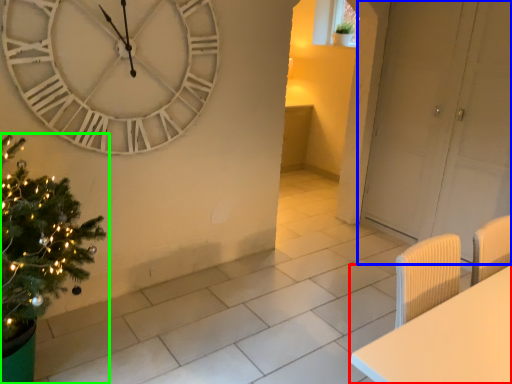
Question: Estimate the real-world distances between objects in this image. Which object is closer to furniture (highlighted by a red box), door (highlighted by a blue box) or christmas tree (highlighted by a green box)?

Choices:
 (A) door
 (B) christmas tree

Answer: (B)